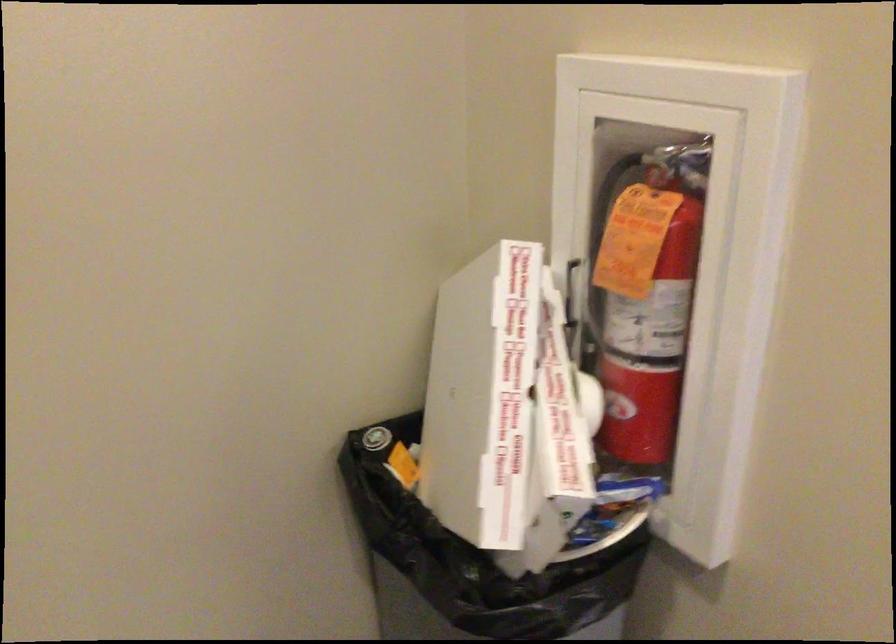
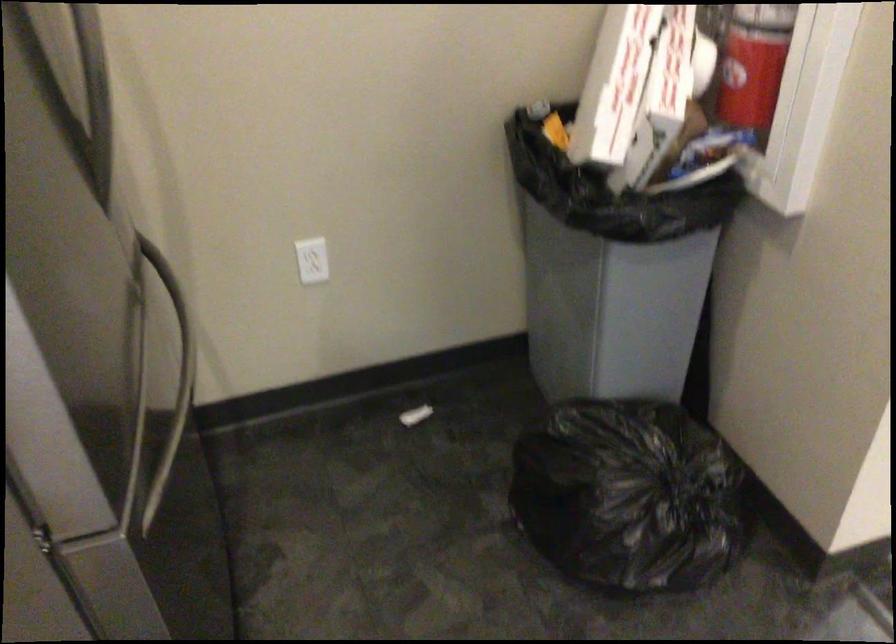
Find the pixel in the second image that matches point 494,455 in the first image.

(614, 84)